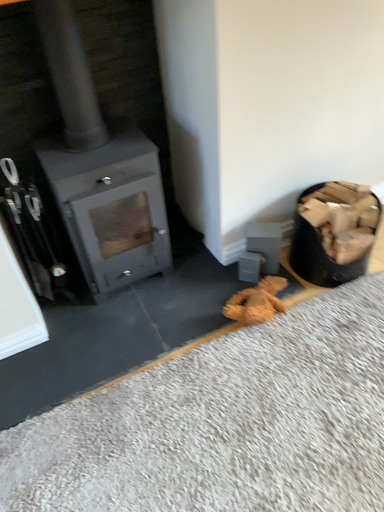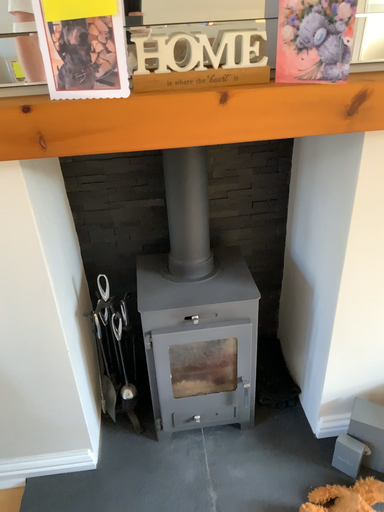
Question: Which way did the camera rotate in the video?

Choices:
 (A) rotated downward
 (B) rotated upward

Answer: (B)